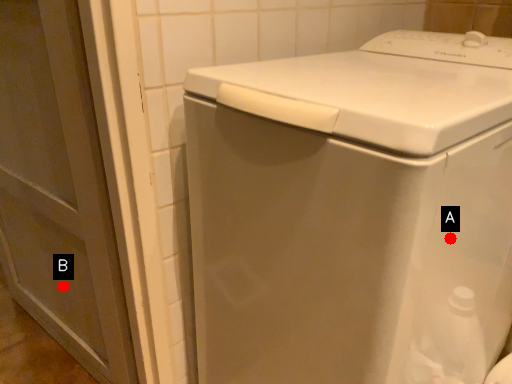
Question: Two points are circled on the image, labeled by A and B beside each circle. Which point is farther to the camera?

Choices:
 (A) A is further
 (B) B is further

Answer: (B)